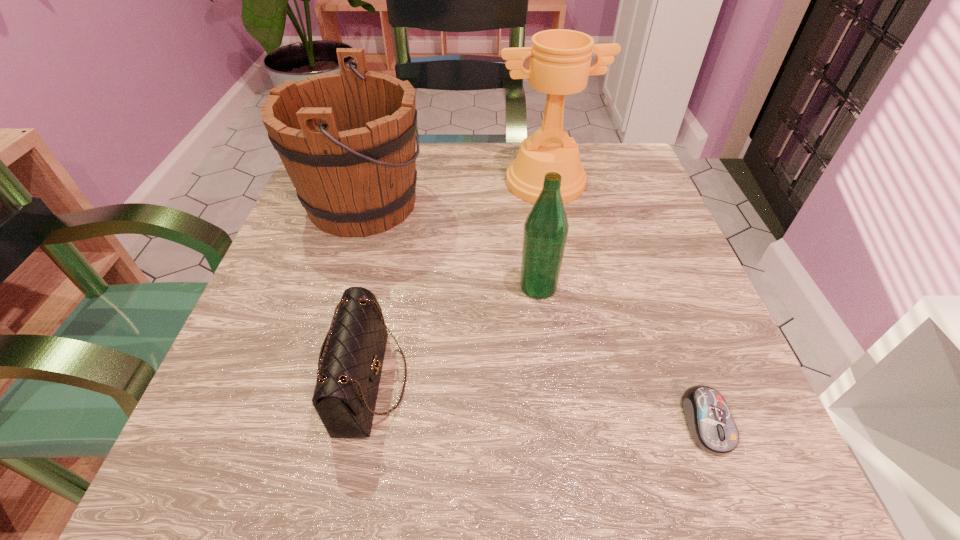
Identify the location of object at the near right corner. The width and height of the screenshot is (960, 540). (710, 423).

Identify the location of free space at the far edge of the desktop. (467, 147).

In the image, there is a desktop. Where is `vacant space at the near edge`? vacant space at the near edge is located at coordinates (316, 463).

Where is `vacant space at the left edge`? The height and width of the screenshot is (540, 960). vacant space at the left edge is located at coordinates (231, 373).

Where is `vacant space at the right edge of the desktop`? The width and height of the screenshot is (960, 540). vacant space at the right edge of the desktop is located at coordinates (636, 262).

The image size is (960, 540). In the image, there is a desktop. In order to click on free space at the near right corner in this screenshot , I will do `click(753, 485)`.

This screenshot has width=960, height=540. In order to click on vacant space that's between the award and the wine bucket in this screenshot , I will do `click(454, 193)`.

Where is `free space between the wine bucket and the computer mouse`? The width and height of the screenshot is (960, 540). free space between the wine bucket and the computer mouse is located at coordinates (535, 313).

The width and height of the screenshot is (960, 540). In order to click on vacant area between the wine bucket and the award in this screenshot , I will do `click(454, 193)`.

Locate an element on the screen. The image size is (960, 540). vacant space that is in between the shortest object and the wine bucket is located at coordinates (535, 313).